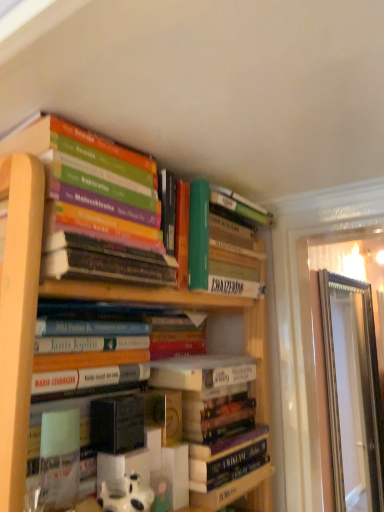
Locate an element on the screen. The image size is (384, 512). multicolored hardcover books at upper left is located at coordinates (132, 211).

The image size is (384, 512). What do you see at coordinates (132, 211) in the screenshot?
I see `multicolored hardcover books at upper left` at bounding box center [132, 211].

Image resolution: width=384 pixels, height=512 pixels. Find the location of `multicolored hardcover books at upper left`. multicolored hardcover books at upper left is located at coordinates (132, 211).